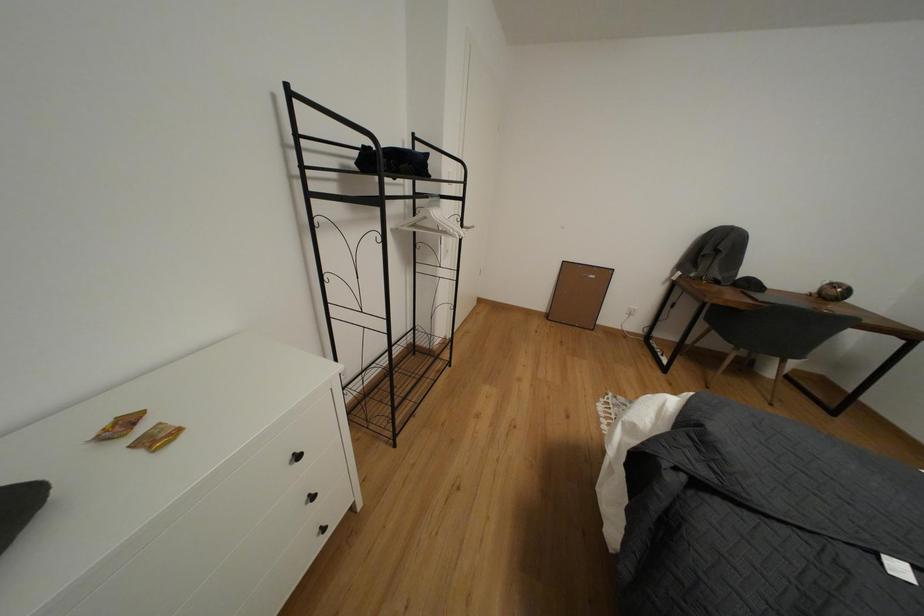
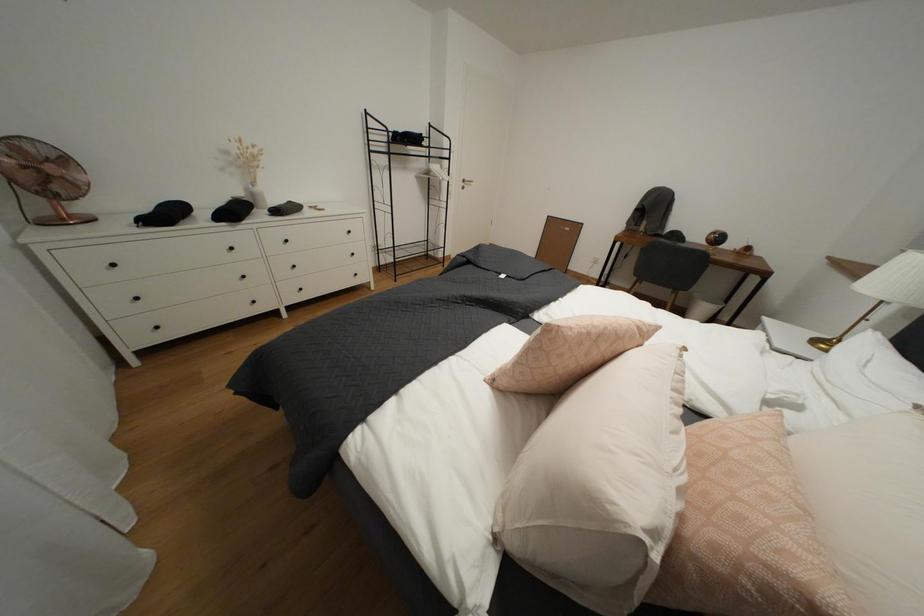
What movement of the cameraman would produce the second image?

The cameraman moved toward right, backward.